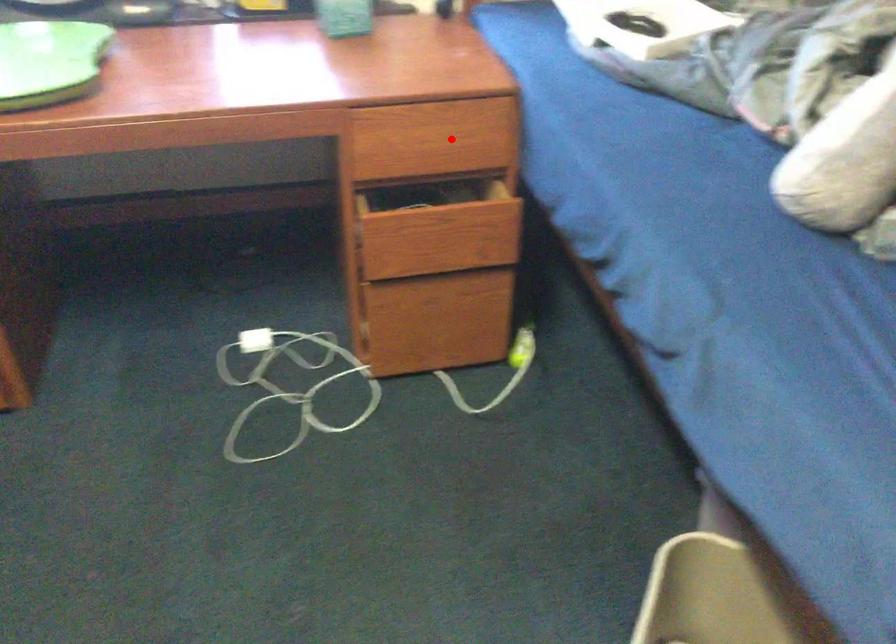
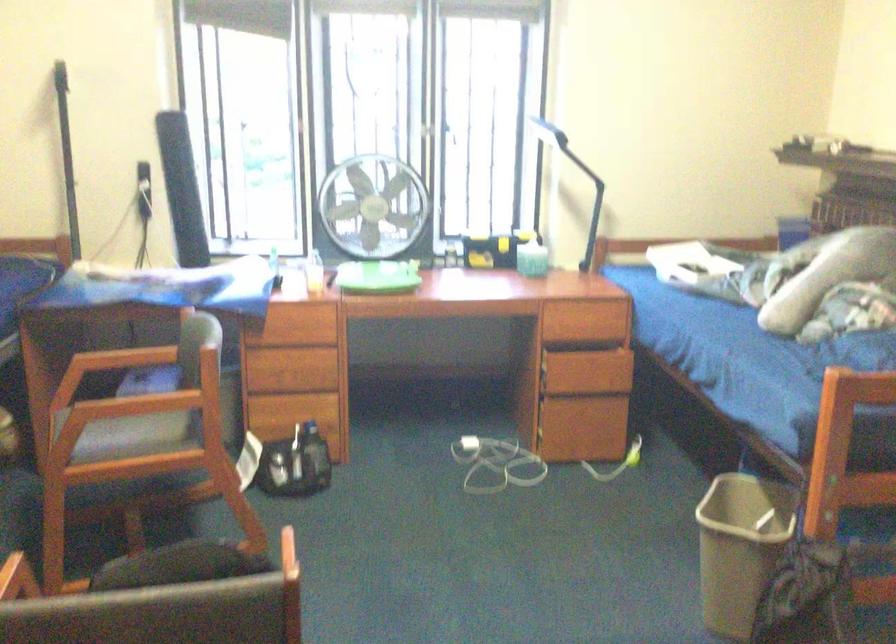
In the second image, find the point that corresponds to the highlighted location in the first image.

(596, 319)